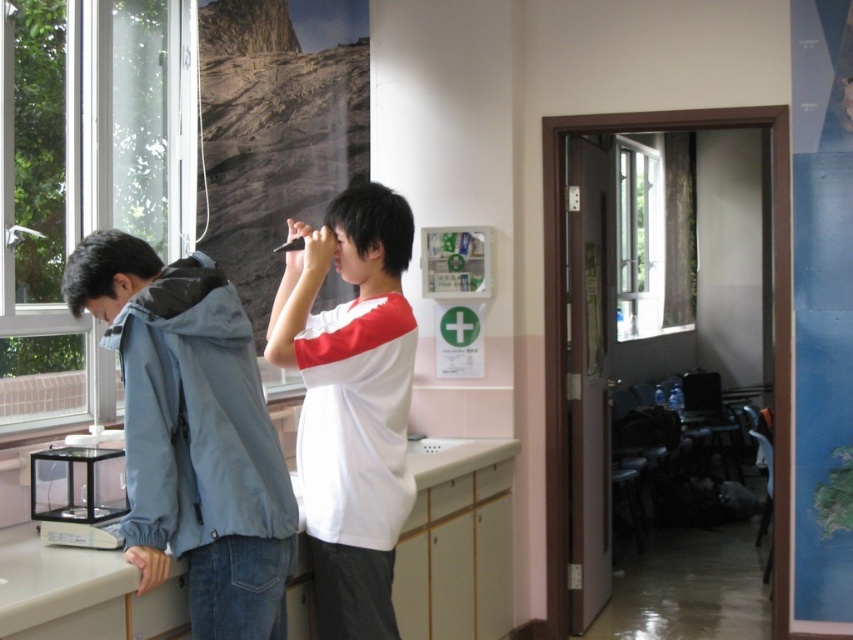
Question: Estimate the real-world distances between objects in this image. Which object is farther from the white matte shirt at center?

Choices:
 (A) white glossy countertop at lower center
 (B) transparent glass window at left
 (C) light blue fabric jacket at left

Answer: (B)

Question: Can you confirm if transparent glass window at left is positioned below white glossy countertop at lower center?

Choices:
 (A) yes
 (B) no

Answer: (B)

Question: Is transparent glass window at left positioned in front of light blue fabric jacket at left?

Choices:
 (A) no
 (B) yes

Answer: (A)

Question: Which object is the farthest from the white matte shirt at center?

Choices:
 (A) white glossy countertop at lower center
 (B) light blue fabric jacket at left

Answer: (A)

Question: Observing the image, what is the correct spatial positioning of transparent glass window at left in reference to white matte shirt at center?

Choices:
 (A) below
 (B) above

Answer: (B)

Question: Among these objects, which one is nearest to the camera?

Choices:
 (A) light blue fabric jacket at left
 (B) transparent glass window at left

Answer: (A)